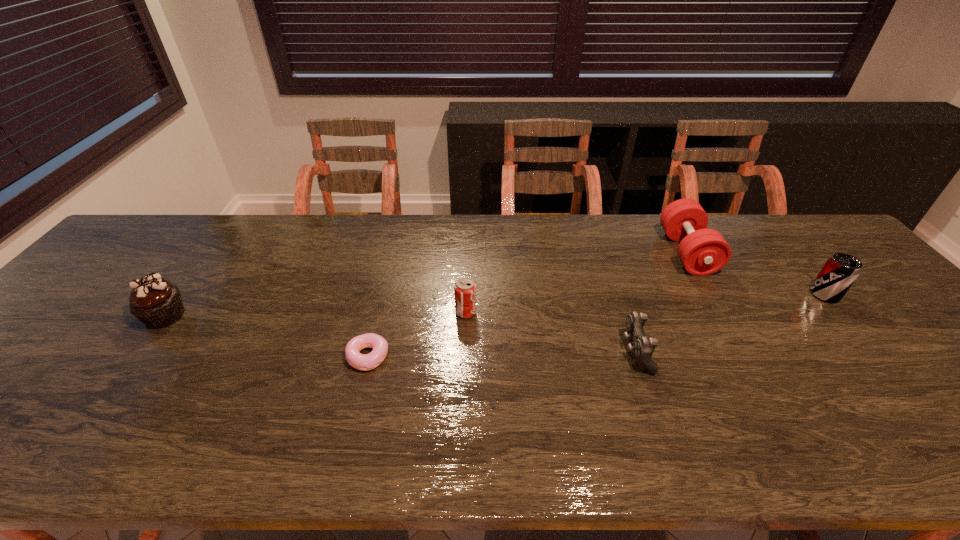
Image resolution: width=960 pixels, height=540 pixels. What are the coordinates of `the fifth object from left to right` in the screenshot? It's located at (702, 251).

At what (x,y) coordinates should I click in order to perform the action: click on the farthest object. Please return your answer as a coordinate pair (x, y). Image resolution: width=960 pixels, height=540 pixels. Looking at the image, I should click on (702, 251).

At what (x,y) coordinates should I click in order to perform the action: click on the right soda can. Please return your answer as a coordinate pair (x, y). Image resolution: width=960 pixels, height=540 pixels. Looking at the image, I should click on (840, 271).

Identify the location of the farther soda can. (840, 271).

Where is `cupcake`? This screenshot has height=540, width=960. cupcake is located at coordinates (157, 303).

Locate an element on the screen. The image size is (960, 540). the fourth object from right to left is located at coordinates (465, 288).

Where is `the nearer soda can`? The width and height of the screenshot is (960, 540). the nearer soda can is located at coordinates (465, 288).

Locate an element on the screen. This screenshot has height=540, width=960. the fifth tallest object is located at coordinates (643, 347).

The height and width of the screenshot is (540, 960). In order to click on control in this screenshot , I will do `click(643, 347)`.

The height and width of the screenshot is (540, 960). I want to click on the second object from left to right, so click(x=365, y=362).